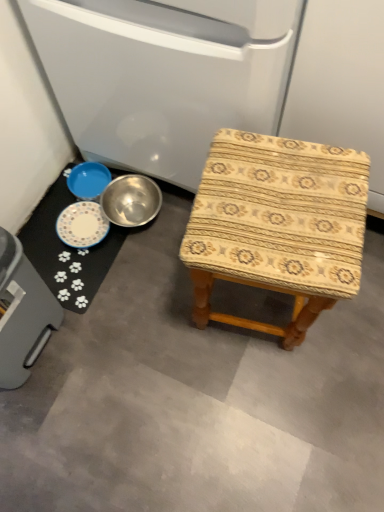
Image resolution: width=384 pixels, height=512 pixels. I want to click on vacant space in front of wooden-patterned stool at center, so click(x=267, y=401).